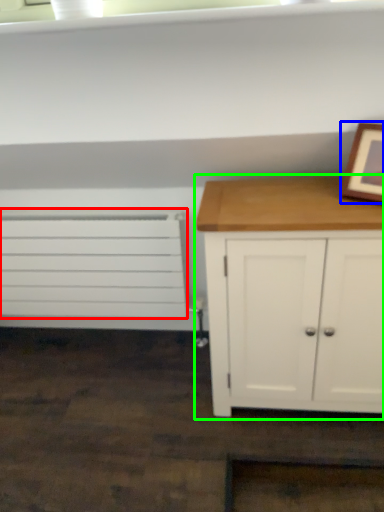
Question: Estimate the real-world distances between objects in this image. Which object is closer to drawer (highlighted by a red box), picture frame (highlighted by a blue box) or chest of drawers (highlighted by a green box)?

Choices:
 (A) picture frame
 (B) chest of drawers

Answer: (B)